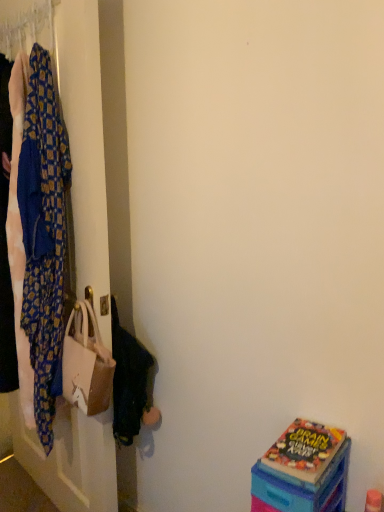
Measure the distance between matte plastic box at lower right and camera.

The distance of matte plastic box at lower right from camera is 36.32 inches.

The height and width of the screenshot is (512, 384). What do you see at coordinates (302, 471) in the screenshot? I see `matte plastic box at lower right` at bounding box center [302, 471].

In order to face patterned fabric at left, should I rotate leftwards or rightwards?

A 20.618 degree turn to the left will do.

The image size is (384, 512). What do you see at coordinates (85, 149) in the screenshot? I see `patterned fabric at left` at bounding box center [85, 149].

The image size is (384, 512). What are the coordinates of `matte plastic box at lower right` in the screenshot? It's located at (302, 471).

Between blue patterned fabric at left and matte plastic box at lower right, which one has less height?

matte plastic box at lower right.

Considering the sizes of objects blue patterned fabric at left and matte plastic box at lower right in the image provided, who is bigger, blue patterned fabric at left or matte plastic box at lower right?

With larger size is blue patterned fabric at left.

Is blue patterned fabric at left positioned beyond the bounds of matte plastic box at lower right?

Yes.

Is blue patterned fabric at left not close to matte plastic box at lower right?

That's not correct — blue patterned fabric at left is a little close to matte plastic box at lower right.

From the image's perspective, would you say patterned fabric at left is positioned over matte plastic box at lower right?

Yes, from the image's perspective, patterned fabric at left is above matte plastic box at lower right.

Which is more to the left, patterned fabric at left or matte plastic box at lower right?

Positioned to the left is patterned fabric at left.

Is patterned fabric at left directly adjacent to matte plastic box at lower right?

No, patterned fabric at left is not touching matte plastic box at lower right.

How different are the orientations of patterned fabric at left and matte plastic box at lower right in degrees?

The angle between the facing direction of patterned fabric at left and the facing direction of matte plastic box at lower right is 6.85 degrees.

Is beige fabric handbag at left further to the viewer compared to patterned fabric at left?

Yes, beige fabric handbag at left is further from the camera.

Which is correct: beige fabric handbag at left is inside patterned fabric at left, or outside of it?

beige fabric handbag at left is located inside patterned fabric at left.

Does beige fabric handbag at left have a larger size compared to patterned fabric at left?

Actually, beige fabric handbag at left might be smaller than patterned fabric at left.

In terms of size, does patterned fabric at left appear bigger or smaller than blue patterned fabric at left?

In the image, patterned fabric at left appears to be larger than blue patterned fabric at left.

Which is in front, point (108, 262) or point (54, 247)?

The point (54, 247) is closer.

From a real-world perspective, does patterned fabric at left stand above blue patterned fabric at left?

Incorrect, from a real-world perspective, patterned fabric at left is lower than blue patterned fabric at left.

Is patterned fabric at left outside of blue patterned fabric at left?

patterned fabric at left is positioned outside blue patterned fabric at left.

From the image's perspective, between blue patterned fabric at left and beige fabric handbag at left, which one is located above?

blue patterned fabric at left appears higher in the image.

Considering the sizes of objects blue patterned fabric at left and beige fabric handbag at left in the image provided, who is bigger, blue patterned fabric at left or beige fabric handbag at left?

Bigger between the two is blue patterned fabric at left.

What's the angular difference between blue patterned fabric at left and beige fabric handbag at left's facing directions?

They differ by 1.05 degrees in their facing directions.

Consider the image. Is blue patterned fabric at left at the left side of patterned fabric at left?

No.

Does point (42, 95) appear closer or farther from the camera than point (67, 93)?

Point (42, 95) is positioned closer to the camera compared to point (67, 93).

The image size is (384, 512). I want to click on closet on the left side of blue patterned fabric at left, so pyautogui.click(x=85, y=149).

Can you tell me how much blue patterned fabric at left and patterned fabric at left differ in facing direction?

There is a 0.524-degree angle between the facing directions of blue patterned fabric at left and patterned fabric at left.

Does point (76, 362) appear closer or farther from the camera than point (277, 453)?

Clearly, point (76, 362) is more distant from the camera than point (277, 453).

Which of these two, beige fabric handbag at left or matte plastic box at lower right, is smaller?

matte plastic box at lower right.

Is matte plastic box at lower right at the back of beige fabric handbag at left?

No, beige fabric handbag at left is not facing the opposite direction of matte plastic box at lower right.

I want to click on blanket that appears on the left of matte plastic box at lower right, so click(x=52, y=236).

You are a GUI agent. You are given a task and a screenshot of the screen. Output one action in this format:
    pyautogui.click(x=<x>, y=<y>)
    Task: Click on the closet that is above the matte plastic box at lower right (from the image's perspective)
    The image size is (384, 512).
    Given the screenshot: What is the action you would take?
    [85, 149]

Based on their spatial positions, is matte plastic box at lower right or patterned fabric at left further from blue patterned fabric at left?

matte plastic box at lower right.

When comparing their distances from beige fabric handbag at left, does matte plastic box at lower right or blue patterned fabric at left seem further?

matte plastic box at lower right.

Looking at this image, based on their spatial positions, is blue patterned fabric at left or patterned fabric at left closer to matte plastic box at lower right?

Among the two, patterned fabric at left is located nearer to matte plastic box at lower right.

Estimate the real-world distances between objects in this image. Which object is further from blue patterned fabric at left, patterned fabric at left or matte plastic box at lower right?

matte plastic box at lower right is positioned further to the anchor blue patterned fabric at left.

When comparing their distances from beige fabric handbag at left, does patterned fabric at left or blue patterned fabric at left seem further?

patterned fabric at left is further to beige fabric handbag at left.

From the image, which object appears to be nearer to matte plastic box at lower right, patterned fabric at left or blue patterned fabric at left?

patterned fabric at left.

Considering their positions, is beige fabric handbag at left positioned further to patterned fabric at left than blue patterned fabric at left?

blue patterned fabric at left lies further to patterned fabric at left than the other object.

Based on their spatial positions, is blue patterned fabric at left or matte plastic box at lower right further from patterned fabric at left?

matte plastic box at lower right lies further to patterned fabric at left than the other object.

This screenshot has height=512, width=384. What are the coordinates of `blanket situated between patterned fabric at left and matte plastic box at lower right from left to right` in the screenshot? It's located at (52, 236).

Where is `closet between blue patterned fabric at left and beige fabric handbag at left in the up-down direction`? The height and width of the screenshot is (512, 384). closet between blue patterned fabric at left and beige fabric handbag at left in the up-down direction is located at coordinates (85, 149).

Locate an element on the screen. The image size is (384, 512). handbag between patterned fabric at left and matte plastic box at lower right is located at coordinates (86, 364).

Image resolution: width=384 pixels, height=512 pixels. Identify the location of handbag between blue patterned fabric at left and matte plastic box at lower right. (86, 364).